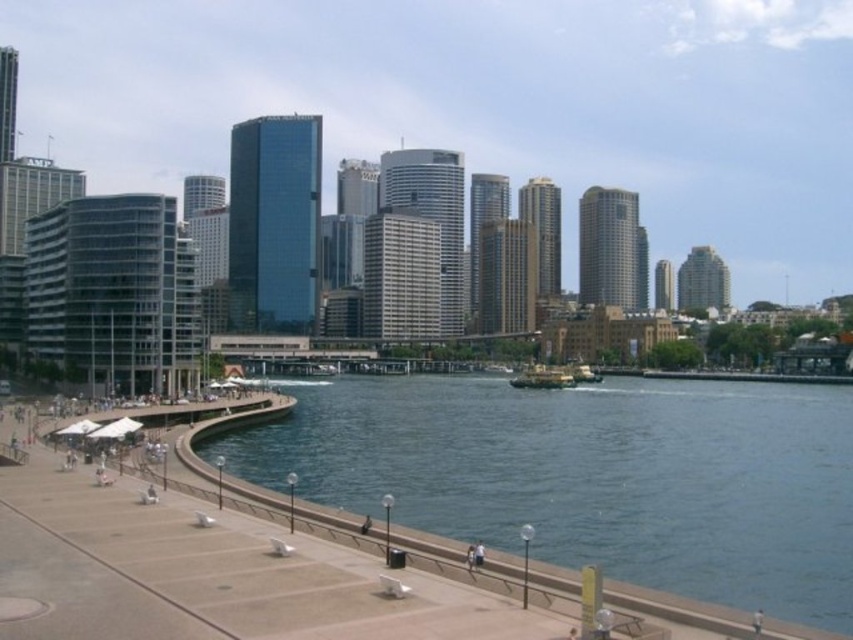
Does greenish-blue water at lower left appear under metallic gray boat at center?

Yes.

Is point (648, 538) farther from camera compared to point (546, 378)?

No.

Is point (231, 472) positioned before point (566, 372)?

Yes, point (231, 472) is in front of point (566, 372).

Identify the location of greenish-blue water at lower left. (590, 476).